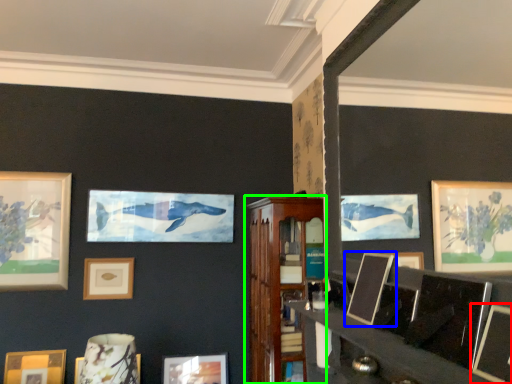
Question: Considering the real-world distances, which object is farthest from picture frame (highlighted by a red box)? picture frame (highlighted by a blue box) or shelf (highlighted by a green box)?

Choices:
 (A) picture frame
 (B) shelf

Answer: (B)